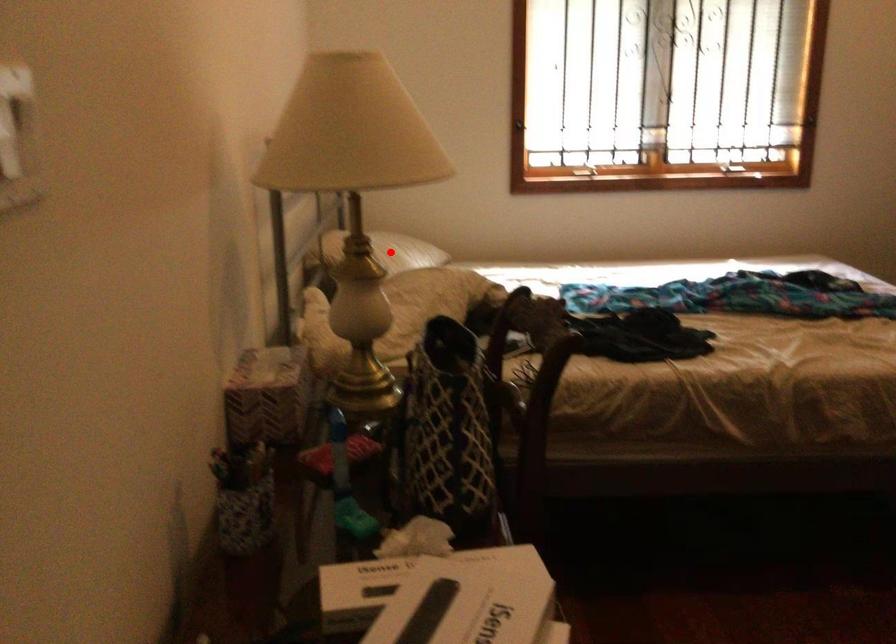
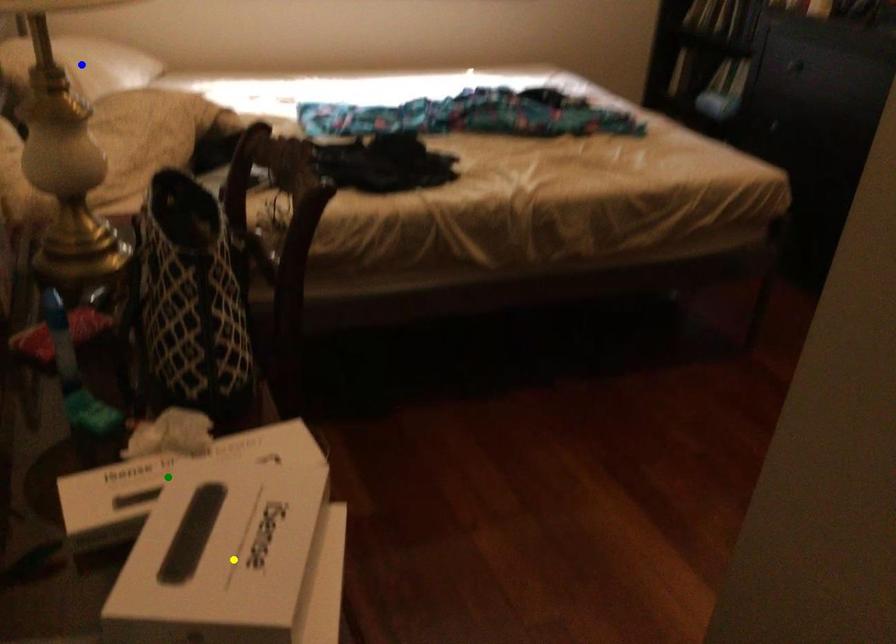
Question: I am providing you with two images of the same scene from different viewpoints. A red point is marked on the first image. You are given multiple points on the second image. Can you choose the point in image 2 that corresponds to the point in image 1?

Choices:
 (A) yellow point
 (B) blue point
 (C) green point

Answer: (B)